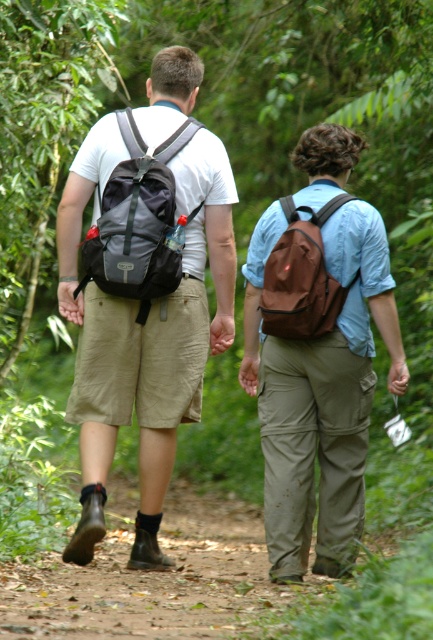
Question: Which of these objects is positioned closest to the matte black backpack at center?

Choices:
 (A) matte black backpack at left
 (B) brown matte backpack at center
 (C) brown fabric backpack at center

Answer: (B)

Question: Does matte black backpack at center have a greater width compared to matte gray backpack at center?

Choices:
 (A) yes
 (B) no

Answer: (A)

Question: Is matte black backpack at center bigger than brown matte backpack at center?

Choices:
 (A) no
 (B) yes

Answer: (B)

Question: Based on their relative distances, which object is nearer to the matte gray backpack at center?

Choices:
 (A) brown matte backpack at center
 (B) brown fabric backpack at center

Answer: (B)

Question: Is brown matte backpack at center wider than matte gray backpack at center?

Choices:
 (A) yes
 (B) no

Answer: (A)

Question: Based on their relative distances, which object is farther from the matte black backpack at left?

Choices:
 (A) brown fabric backpack at center
 (B) matte gray backpack at center
 (C) matte black backpack at center
 (D) brown matte backpack at center

Answer: (A)